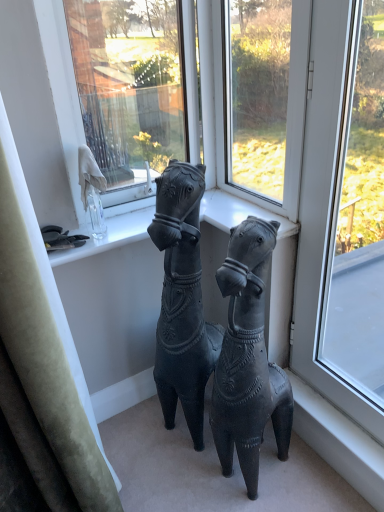
Question: Is the depth of transparent glass window at right, which is counted as the first window, starting from the right, greater than that of transparent glass window screen at upper center?

Choices:
 (A) no
 (B) yes

Answer: (A)

Question: Does transparent glass window at right, which is the second window from left to right, lie in front of transparent glass window screen at upper center?

Choices:
 (A) yes
 (B) no

Answer: (A)

Question: Can you confirm if transparent glass window at right, which is the second window from left to right, is wider than transparent glass window screen at upper center?

Choices:
 (A) yes
 (B) no

Answer: (B)

Question: Is transparent glass window at right, which is the second window from left to right, facing away from transparent glass window screen at upper center?

Choices:
 (A) no
 (B) yes

Answer: (A)

Question: Does transparent glass window at right, which is counted as the first window, starting from the right, have a greater height compared to transparent glass window screen at upper center?

Choices:
 (A) yes
 (B) no

Answer: (A)

Question: Are transparent glass window at right, which is the second window from left to right, and transparent glass window screen at upper center beside each other?

Choices:
 (A) yes
 (B) no

Answer: (B)

Question: Considering the relative sizes of matte black horse at center, acting as the 2th horse starting from the right, and transparent glass window at right, which is the second window from left to right, in the image provided, is matte black horse at center, acting as the 2th horse starting from the right, smaller than transparent glass window at right, which is the second window from left to right,?

Choices:
 (A) yes
 (B) no

Answer: (B)

Question: From the image's perspective, would you say matte black horse at center, which is the 1th horse from left to right, is positioned over transparent glass window at right, which is the second window from left to right?

Choices:
 (A) yes
 (B) no

Answer: (B)

Question: From a real-world perspective, is matte black horse at center, which is the 1th horse from left to right, located higher than transparent glass window at right, which is counted as the first window, starting from the right?

Choices:
 (A) yes
 (B) no

Answer: (B)

Question: Is matte black horse at center, which is the 1th horse from left to right, to the right of transparent glass window at right, which is counted as the first window, starting from the right, from the viewer's perspective?

Choices:
 (A) no
 (B) yes

Answer: (A)

Question: Does matte black horse at center, acting as the 2th horse starting from the right, have a lesser height compared to transparent glass window at right, which is counted as the first window, starting from the right?

Choices:
 (A) no
 (B) yes

Answer: (B)

Question: Is transparent glass window at right, which is the second window from left to right, located within matte black horse at center, acting as the 2th horse starting from the right?

Choices:
 (A) yes
 (B) no

Answer: (B)

Question: Considering the relative sizes of transparent glass window at center, marked as the 1th window in a left-to-right arrangement, and matte black horse at center, positioned as the 2th horse in left-to-right order, in the image provided, is transparent glass window at center, marked as the 1th window in a left-to-right arrangement, thinner than matte black horse at center, positioned as the 2th horse in left-to-right order,?

Choices:
 (A) yes
 (B) no

Answer: (A)